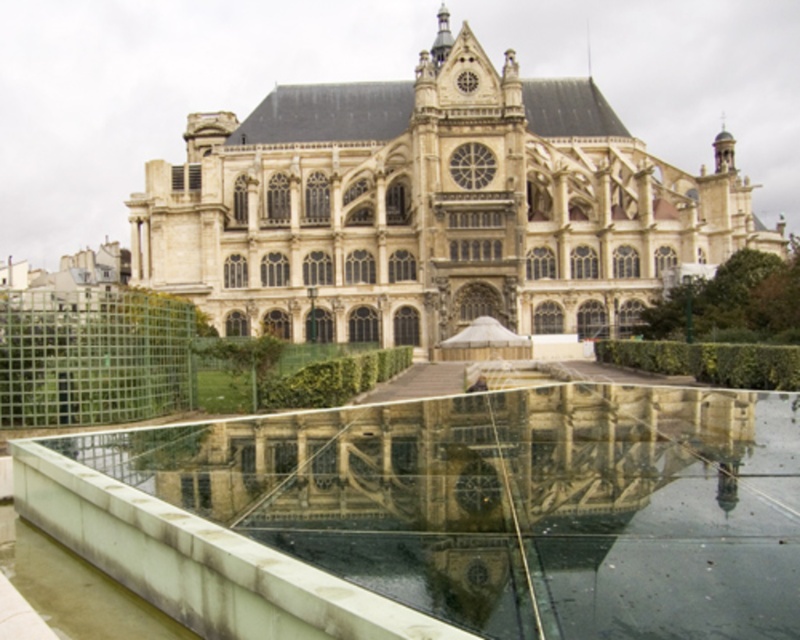
You are standing in front of the grand historic building and want to take a photo of the clear glass pool at center. Which direction should you face to capture the reflection of the rose window in the pool?

The clear glass pool at center is located at point (x=449, y=515), so facing towards the center of the pool will allow you to capture the reflection of the rose window since the pool is positioned to mirror the building.

You are standing in front of the grand historic building. You notice the clear glass pool at center and the beige stone church at center. Which one has a greater height?

The beige stone church at center is taller than the clear glass pool at center.